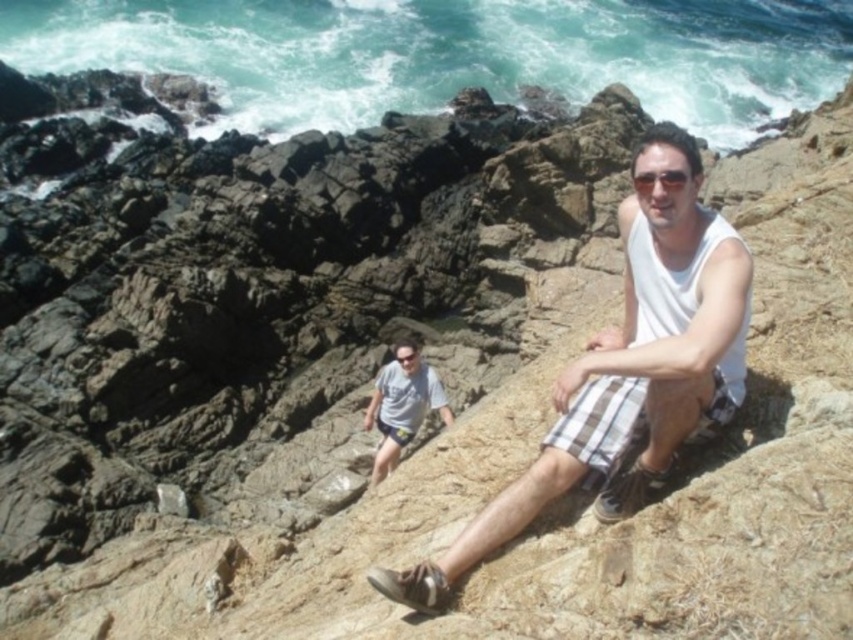
You are a photographer trying to capture both the white cotton tank top at center and the white cotton shirt at center in the same frame. Since they are both white, how can you distinguish which one is closer to you?

The white cotton tank top at center is in front of the white cotton shirt at center, so it will appear closer to you in the photo.

You are standing at the camera position and want to reach the point at coordinates (666, 248). Given that the path is uneven and rocky, do you think you can walk directly to that point without any obstacles?

The point at coordinates (666, 248) is 30.05 feet away from the camera. Since the path is described as uneven and rocky, there may be obstacles such as loose rocks and dry grass patches, so it might be challenging to walk directly to that point without encountering some obstacles.